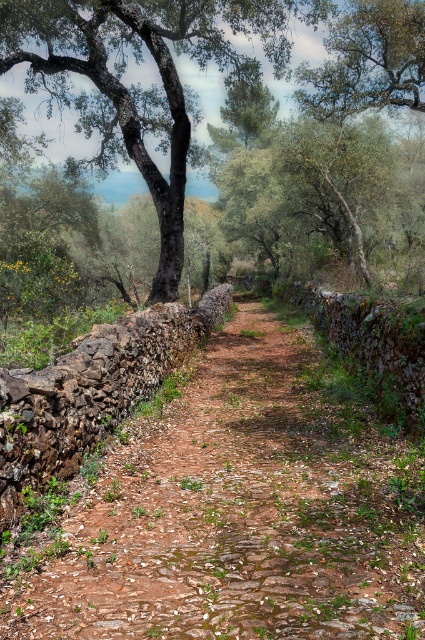
Does dark brown bark tree at upper left have a lesser height compared to green leafy tree at upper center?

In fact, dark brown bark tree at upper left may be taller than green leafy tree at upper center.

Does dark brown bark tree at upper left have a greater width compared to green leafy tree at upper center?

Yes.

Does point (209, 16) come behind point (354, 65)?

No.

You are a GUI agent. You are given a task and a screenshot of the screen. Output one action in this format:
    pyautogui.click(x=<x>, y=<y>)
    Task: Click on the dark brown bark tree at upper left
    The height and width of the screenshot is (640, 425).
    Given the screenshot: What is the action you would take?
    pyautogui.click(x=139, y=84)

Looking at this image, can you confirm if brown stone path at center is positioned to the left of dark brown bark tree at upper left?

Incorrect, brown stone path at center is not on the left side of dark brown bark tree at upper left.

Does brown stone path at center appear over dark brown bark tree at upper left?

Actually, brown stone path at center is below dark brown bark tree at upper left.

Which is behind, point (277, 412) or point (272, 10)?

Positioned behind is point (272, 10).

Where is `brown stone path at center`? The width and height of the screenshot is (425, 640). brown stone path at center is located at coordinates click(234, 512).

Between brown stone path at center and green leafy tree at upper center, which one is positioned higher?

green leafy tree at upper center

Can you confirm if brown stone path at center is bigger than green leafy tree at upper center?

No.

The height and width of the screenshot is (640, 425). In order to click on brown stone path at center in this screenshot , I will do `click(234, 512)`.

Find the location of a particular element. This screenshot has height=640, width=425. brown stone path at center is located at coordinates (234, 512).